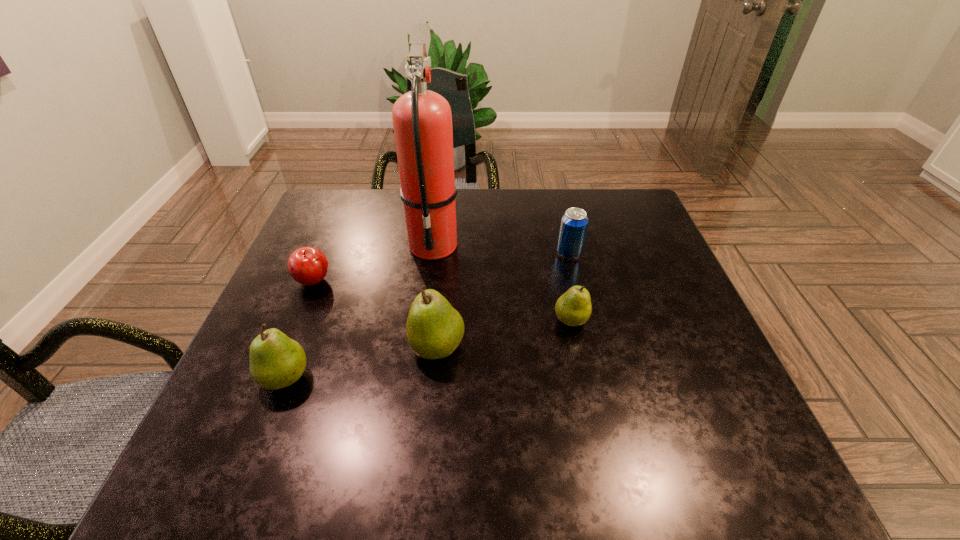
Please point a spot to add another pear on the right. Please provide its 2D coordinates. Your answer should be formatted as a tuple, i.e. [(x, y)], where the tuple contains the x and y coordinates of a point satisfying the conditions above.

[(690, 296)]